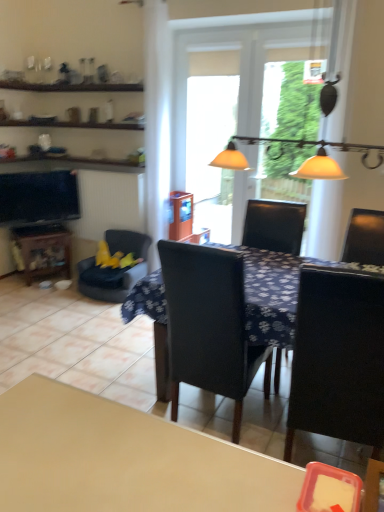
Find the location of a particular element. Image resolution: width=384 pixels, height=512 pixels. velvet yellow chair at left, placed as the third chair when sorted from front to back is located at coordinates (128, 242).

At what (x,y) coordinates should I click in order to perform the action: click on transparent glass window at center. Please return your answer as a coordinate pair (x, y). This screenshot has width=384, height=512. Looking at the image, I should click on (233, 79).

The image size is (384, 512). Identify the location of black leather chair at right, arranged as the first chair when viewed from the front. (338, 358).

The width and height of the screenshot is (384, 512). What are the coordinates of `matte glass light fixture at upper center` in the screenshot? It's located at (230, 159).

Which of these two, velvet yellow chair at left, the first chair when ordered from back to front, or transparent glass window at center, stands taller?

transparent glass window at center is taller.

From a real-world perspective, relative to transparent glass window at center, is velvet yellow chair at left, the first chair when ordered from back to front, vertically above or below?

velvet yellow chair at left, the first chair when ordered from back to front, is situated lower than transparent glass window at center in the real world.

Is velvet yellow chair at left, positioned as the 3th chair in right-to-left order, bigger than transparent glass window at center?

Indeed, velvet yellow chair at left, positioned as the 3th chair in right-to-left order, has a larger size compared to transparent glass window at center.

Locate an element on the screen. window in front of the velvet yellow chair at left, positioned as the 3th chair in right-to-left order is located at coordinates (233, 79).

Is matte glass light fixture at upper center bigger than velvet yellow chair at left, placed as the third chair when sorted from front to back?

Yes.

In the scene shown: Does matte glass light fixture at upper center lie in front of velvet yellow chair at left, placed as the third chair when sorted from front to back?

Yes, matte glass light fixture at upper center is in front of velvet yellow chair at left, placed as the third chair when sorted from front to back.

From a real-world perspective, is matte glass light fixture at upper center physically below velvet yellow chair at left, positioned as the 3th chair in right-to-left order?

No, from a real-world perspective, matte glass light fixture at upper center is not under velvet yellow chair at left, positioned as the 3th chair in right-to-left order.

Is matte glass light fixture at upper center beside velvet yellow chair at left, the first chair when ordered from back to front?

No, matte glass light fixture at upper center is not touching velvet yellow chair at left, the first chair when ordered from back to front.

Does black leather chair at right, arranged as the first chair when viewed from the front, come behind dark blue fabric table at center?

No.

Does black leather chair at right, which is counted as the 3th chair, starting from the left, contain dark blue fabric table at center?

No, dark blue fabric table at center is not a part of black leather chair at right, which is counted as the 3th chair, starting from the left.

Based on their sizes in the image, would you say black leather chair at right, which is counted as the 3th chair, starting from the left, is bigger or smaller than dark blue fabric table at center?

Clearly, black leather chair at right, which is counted as the 3th chair, starting from the left, is smaller in size than dark blue fabric table at center.

Which object is positioned more to the left, black leather chair at right, which is counted as the 3th chair, starting from the left, or dark blue fabric table at center?

Positioned to the left is dark blue fabric table at center.

Consider the image. Is matte glass light fixture at upper center taller than translucent plastic screen door at center?

No.

Considering the relative positions of matte glass light fixture at upper center and translucent plastic screen door at center in the image provided, is matte glass light fixture at upper center to the left of translucent plastic screen door at center from the viewer's perspective?

Incorrect, matte glass light fixture at upper center is not on the left side of translucent plastic screen door at center.

In terms of width, does matte glass light fixture at upper center look wider or thinner when compared to translucent plastic screen door at center?

In the image, matte glass light fixture at upper center appears to be wider than translucent plastic screen door at center.

From a real-world perspective, who is located higher, matte glass light fixture at upper center or translucent plastic screen door at center?

From a 3D spatial view, matte glass light fixture at upper center is above.

Could you measure the distance between black leather chair at center, which appears as the second chair when viewed from the right, and velvet yellow chair at left, placed as the third chair when sorted from front to back?

black leather chair at center, which appears as the second chair when viewed from the right, and velvet yellow chair at left, placed as the third chair when sorted from front to back, are 1.79 meters apart from each other.

Does black leather chair at center, marked as the 2th chair in a back-to-front arrangement, have a smaller size compared to velvet yellow chair at left, positioned as the 3th chair in right-to-left order?

No, black leather chair at center, marked as the 2th chair in a back-to-front arrangement, is not smaller than velvet yellow chair at left, positioned as the 3th chair in right-to-left order.

Is point (173, 256) in front of point (93, 294)?

Yes.

Is the position of black leather chair at center, marked as the 2th chair in a back-to-front arrangement, more distant than that of velvet yellow chair at left, positioned as the 3th chair in right-to-left order?

No, black leather chair at center, marked as the 2th chair in a back-to-front arrangement, is closer to the camera.

Does black leather chair at center, marked as the 2th chair in a back-to-front arrangement, turn towards matte black tv at left?

No.

In terms of width, does black leather chair at center, which is the 2th chair in left-to-right order, look wider or thinner when compared to matte black tv at left?

Clearly, black leather chair at center, which is the 2th chair in left-to-right order, has more width compared to matte black tv at left.

Choose the correct answer: Is black leather chair at center, which is the 2th chair in left-to-right order, inside matte black tv at left or outside it?

black leather chair at center, which is the 2th chair in left-to-right order, lies outside matte black tv at left.

Locate an element on the screen. The width and height of the screenshot is (384, 512). light fixture above the black leather chair at center, which is counted as the second chair, starting from the front (from a real-world perspective) is located at coordinates (230, 159).

Considering the relative positions of matte glass light fixture at upper center and black leather chair at center, marked as the 2th chair in a back-to-front arrangement, in the image provided, is matte glass light fixture at upper center to the right of black leather chair at center, marked as the 2th chair in a back-to-front arrangement, from the viewer's perspective?

Indeed, matte glass light fixture at upper center is positioned on the right side of black leather chair at center, marked as the 2th chair in a back-to-front arrangement.

Considering the positions of point (323, 168) and point (184, 360), is point (323, 168) closer or farther from the camera than point (184, 360)?

Point (323, 168) is closer to the camera than point (184, 360).

Can black leather chair at center, which appears as the second chair when viewed from the right, be found inside matte glass light fixture at upper center?

No, black leather chair at center, which appears as the second chair when viewed from the right, is not a part of matte glass light fixture at upper center.

From the transparent glass window at center, count the 2nd chair to the left and point to it. Please provide its 2D coordinates.

[(128, 242)]

You are a GUI agent. You are given a task and a screenshot of the screen. Output one action in this format:
    pyautogui.click(x=<x>, y=<y>)
    Task: Click on the 3rd chair positioned below the matte glass light fixture at upper center (from a real-world perspective)
    This screenshot has width=384, height=512.
    Given the screenshot: What is the action you would take?
    pyautogui.click(x=128, y=242)

From the picture: From the image, which object appears to be farther from dark blue fabric table at center, matte glass light fixture at upper center or translucent plastic screen door at center?

translucent plastic screen door at center.

Looking at the image, which one is located closer to velvet yellow chair at left, positioned as the 3th chair in right-to-left order, black leather chair at center, marked as the 2th chair in a back-to-front arrangement, or translucent plastic screen door at center?

translucent plastic screen door at center is closer to velvet yellow chair at left, positioned as the 3th chair in right-to-left order.

Which object lies further to the anchor point black leather chair at center, marked as the 2th chair in a back-to-front arrangement, matte black tv at left or matte glass light fixture at upper center?

The object further to black leather chair at center, marked as the 2th chair in a back-to-front arrangement, is matte black tv at left.

Looking at the image, which one is located further to matte glass light fixture at upper center, dark blue fabric table at center or transparent glass window at center?

transparent glass window at center is positioned further to the anchor matte glass light fixture at upper center.

Looking at the image, which one is located closer to velvet yellow chair at left, which ranks as the first chair in left-to-right order, matte black tv at left or black leather chair at right, arranged as the first chair when viewed from the front?

The object closer to velvet yellow chair at left, which ranks as the first chair in left-to-right order, is matte black tv at left.

Which object lies further to the anchor point dark blue fabric table at center, transparent glass window at center or velvet yellow chair at left, the first chair when ordered from back to front?

transparent glass window at center is further to dark blue fabric table at center.

From the image, which object appears to be farther from matte glass light fixture at upper center, matte black tv at left or translucent plastic screen door at center?

matte black tv at left is positioned further to the anchor matte glass light fixture at upper center.

Looking at the image, which one is located further to black leather chair at right, arranged as the third chair when viewed from the back, matte black tv at left or matte glass light fixture at upper center?

matte black tv at left lies further to black leather chair at right, arranged as the third chair when viewed from the back, than the other object.

Identify the location of window between matte glass light fixture at upper center and translucent plastic screen door at center along the z-axis. This screenshot has width=384, height=512. (233, 79).

Where is `window positioned between dark blue fabric table at center and velvet yellow chair at left, positioned as the 3th chair in right-to-left order, from near to far`? The width and height of the screenshot is (384, 512). window positioned between dark blue fabric table at center and velvet yellow chair at left, positioned as the 3th chair in right-to-left order, from near to far is located at coordinates (233, 79).

You are a GUI agent. You are given a task and a screenshot of the screen. Output one action in this format:
    pyautogui.click(x=<x>, y=<y>)
    Task: Click on the light fixture between black leather chair at right, arranged as the first chair when viewed from the front, and velvet yellow chair at left, placed as the third chair when sorted from front to back, in the front-back direction
    The image size is (384, 512).
    Given the screenshot: What is the action you would take?
    pyautogui.click(x=230, y=159)

Find the location of a particular element. The height and width of the screenshot is (512, 384). chair located between matte glass light fixture at upper center and transparent glass window at center in the depth direction is located at coordinates (206, 328).